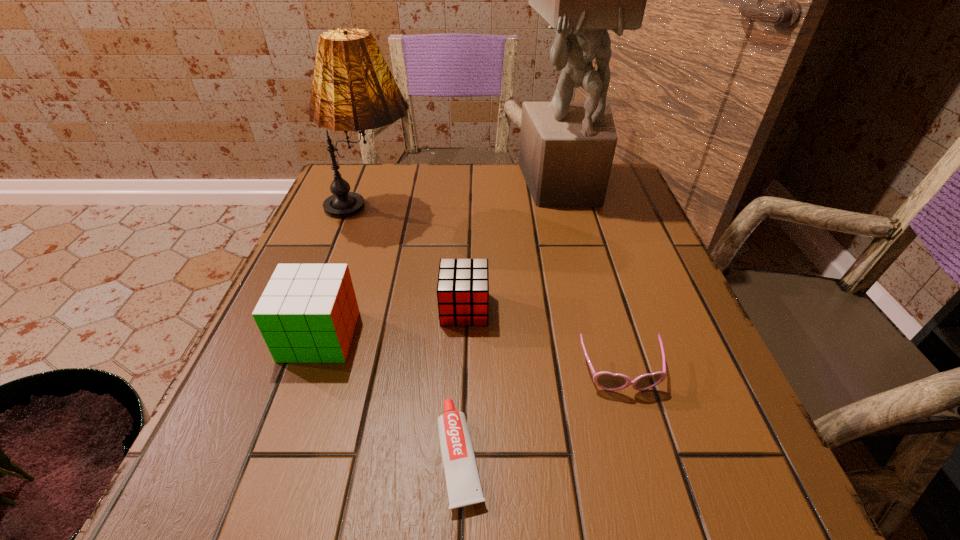
The image size is (960, 540). I want to click on free region located on the front-facing side of the lampshade, so click(x=505, y=213).

This screenshot has width=960, height=540. What are the coordinates of `free region located 0.240m on the front of the left cube` in the screenshot? It's located at pyautogui.click(x=256, y=516).

Locate an element on the screen. The width and height of the screenshot is (960, 540). vacant space located on the back of the right cube is located at coordinates (466, 269).

The height and width of the screenshot is (540, 960). What are the coordinates of `free spot located 0.100m on the front-facing side of the sunglasses` in the screenshot? It's located at click(645, 458).

I want to click on vacant space located on the back of the toothpaste, so click(x=467, y=276).

Image resolution: width=960 pixels, height=540 pixels. Find the location of `sculpture that is at the far edge`. sculpture that is at the far edge is located at coordinates 566,152.

Locate an element on the screen. This screenshot has height=540, width=960. lampshade positioned at the far edge is located at coordinates (353, 89).

Where is `object located at the near edge`? Image resolution: width=960 pixels, height=540 pixels. object located at the near edge is located at coordinates (463, 483).

Find the location of a particular element. lampshade that is at the left edge is located at coordinates (353, 89).

You are a GUI agent. You are given a task and a screenshot of the screen. Output one action in this format:
    pyautogui.click(x=<x>, y=<y>)
    Task: Click on the cube situated at the left edge
    
    Given the screenshot: What is the action you would take?
    (307, 313)